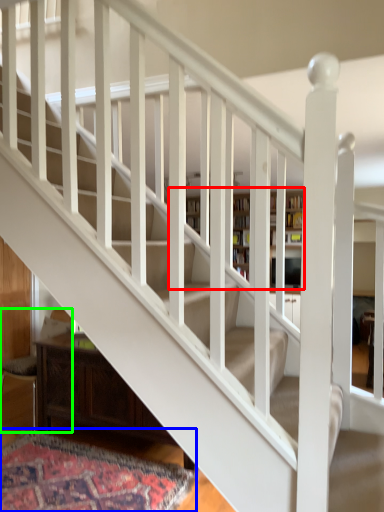
Question: Which is farther away from bookcase (highlighted by a red box)? mat (highlighted by a blue box) or armchair (highlighted by a green box)?

Choices:
 (A) mat
 (B) armchair

Answer: (B)